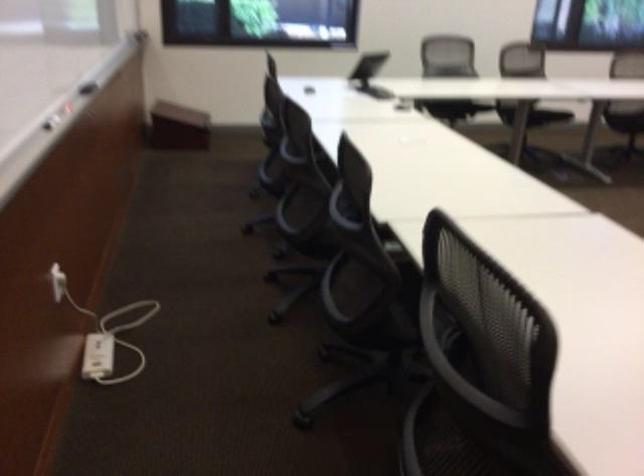
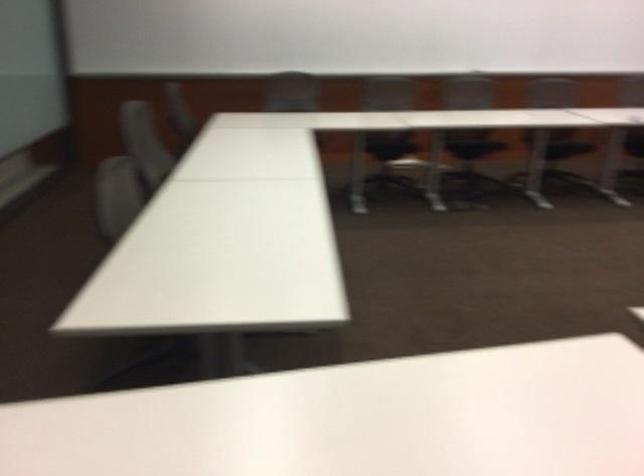
Question: Which direction would the cameraman need to move to produce the second image? Reply with the corresponding letter.

Choices:
 (A) Left
 (B) Right
 (C) Forward
 (D) Backward

Answer: (D)